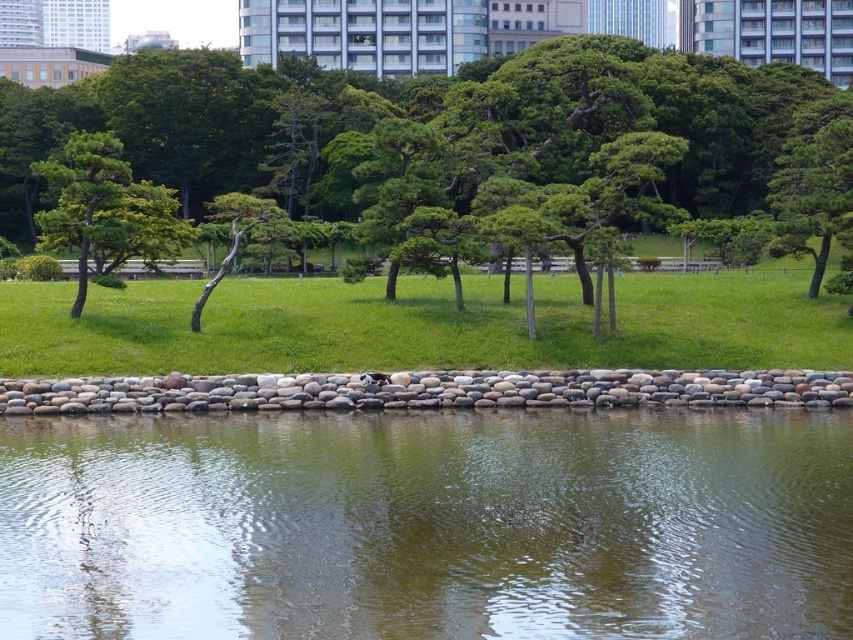
Question: Which of the following is the closest to the observer?

Choices:
 (A) green textured tree at upper right
 (B) green leafy tree at upper left

Answer: (B)

Question: Does green grass at center appear under green textured tree at upper right?

Choices:
 (A) yes
 (B) no

Answer: (A)

Question: Which of these objects is positioned closest to the green leafy tree at center?

Choices:
 (A) clear water at center
 (B) green grass at center

Answer: (B)

Question: In this image, where is green leafy tree at upper left located relative to green textured tree at upper right?

Choices:
 (A) left
 (B) right

Answer: (A)

Question: Observing the image, what is the correct spatial positioning of green leafy tree at center in reference to green textured tree at upper right?

Choices:
 (A) below
 (B) above

Answer: (B)

Question: Which object appears farthest from the camera in this image?

Choices:
 (A) green leafy tree at center
 (B) green grass at center
 (C) clear water at center
 (D) green textured tree at center

Answer: (A)